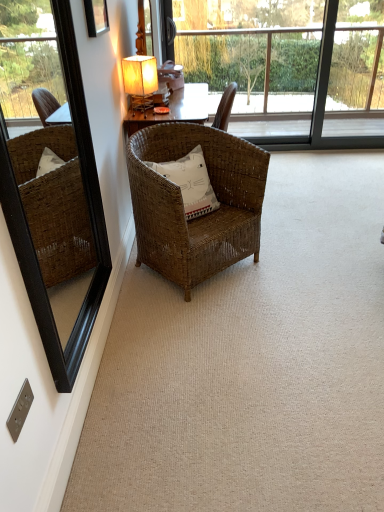
Question: From the image's perspective, is woven brown chair at center on black wood mirror at left?

Choices:
 (A) no
 (B) yes

Answer: (B)

Question: Is woven brown chair at center outside black wood mirror at left?

Choices:
 (A) no
 (B) yes

Answer: (B)

Question: From a real-world perspective, is woven brown chair at center physically above black wood mirror at left?

Choices:
 (A) yes
 (B) no

Answer: (B)

Question: Is woven brown chair at center to the left of black wood mirror at left from the viewer's perspective?

Choices:
 (A) no
 (B) yes

Answer: (A)

Question: Is black wood mirror at left inside woven brown chair at center?

Choices:
 (A) no
 (B) yes

Answer: (A)

Question: Based on their positions, is woven brown chair at center located to the left or right of transparent glass bay window at upper center?

Choices:
 (A) right
 (B) left

Answer: (B)

Question: From the image's perspective, relative to transparent glass bay window at upper center, is woven brown chair at center above or below?

Choices:
 (A) above
 (B) below

Answer: (B)

Question: Which is correct: woven brown chair at center is inside transparent glass bay window at upper center, or outside of it?

Choices:
 (A) inside
 (B) outside

Answer: (B)

Question: Considering their positions, is woven brown chair at center located in front of or behind transparent glass bay window at upper center?

Choices:
 (A) front
 (B) behind

Answer: (A)

Question: In terms of width, does white cotton pillow at center look wider or thinner when compared to wooden picture frame at upper left?

Choices:
 (A) wide
 (B) thin

Answer: (A)

Question: In terms of height, does white cotton pillow at center look taller or shorter compared to wooden picture frame at upper left?

Choices:
 (A) tall
 (B) short

Answer: (B)

Question: Choose the correct answer: Is white cotton pillow at center inside wooden picture frame at upper left or outside it?

Choices:
 (A) outside
 (B) inside

Answer: (A)

Question: From a real-world perspective, is white cotton pillow at center above or below wooden picture frame at upper left?

Choices:
 (A) above
 (B) below

Answer: (B)

Question: Looking at their shapes, would you say transparent glass bay window at upper center is wider or thinner than white cotton pillow at center?

Choices:
 (A) thin
 (B) wide

Answer: (A)

Question: Based on their sizes in the image, would you say transparent glass bay window at upper center is bigger or smaller than white cotton pillow at center?

Choices:
 (A) small
 (B) big

Answer: (B)